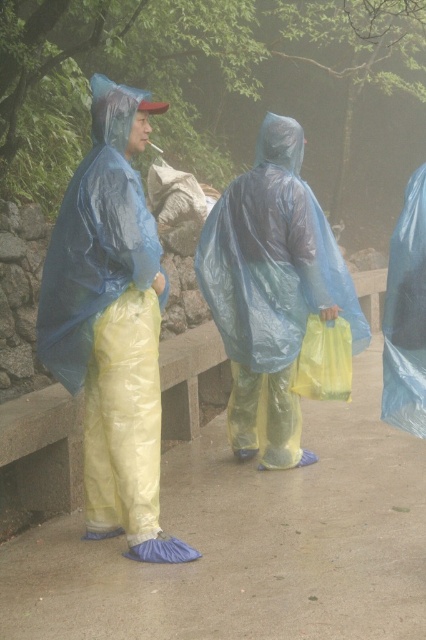
Question: Is matte blue raincoat at left further to the viewer compared to transparent plastic poncho at center?

Choices:
 (A) no
 (B) yes

Answer: (A)

Question: Which point is closer to the camera taking this photo?

Choices:
 (A) (181, 547)
 (B) (239, 182)

Answer: (A)

Question: Where is matte blue raincoat at left located in relation to transparent plastic poncho at center in the image?

Choices:
 (A) right
 (B) left

Answer: (B)

Question: Is matte blue raincoat at left below transparent plastic poncho at center?

Choices:
 (A) yes
 (B) no

Answer: (A)

Question: Which of the following is the closest to the observer?

Choices:
 (A) matte blue raincoat at left
 (B) transparent plastic poncho at center

Answer: (A)